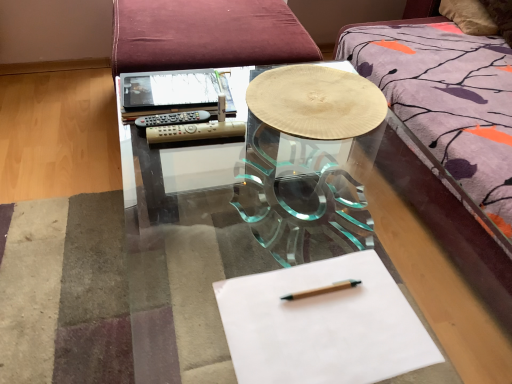
You are a GUI agent. You are given a task and a screenshot of the screen. Output one action in this format:
    pyautogui.click(x=<x>, y=<y>)
    Task: Click on the vacant point above matte black notebook at upper left (from a real-world perspective)
    
    Given the screenshot: What is the action you would take?
    [183, 79]